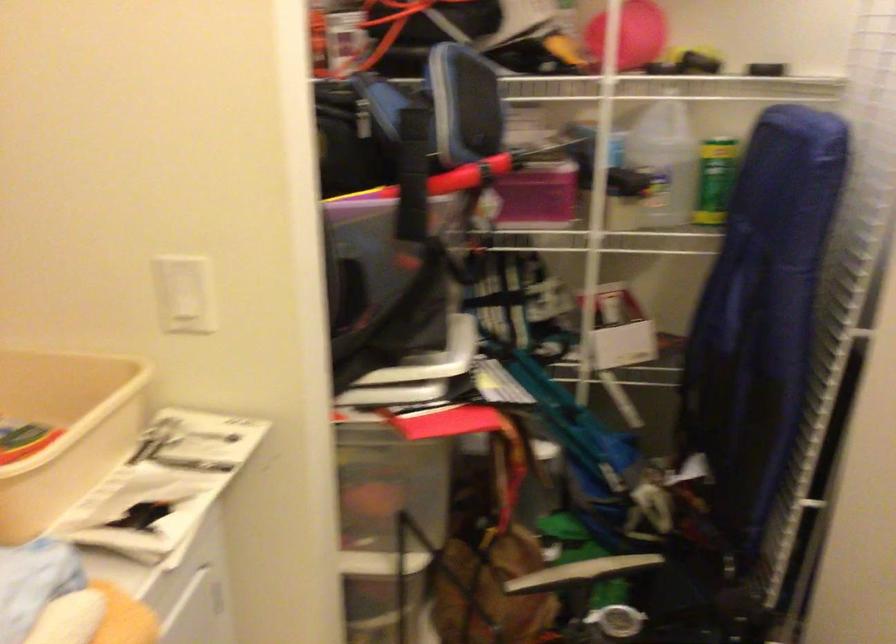
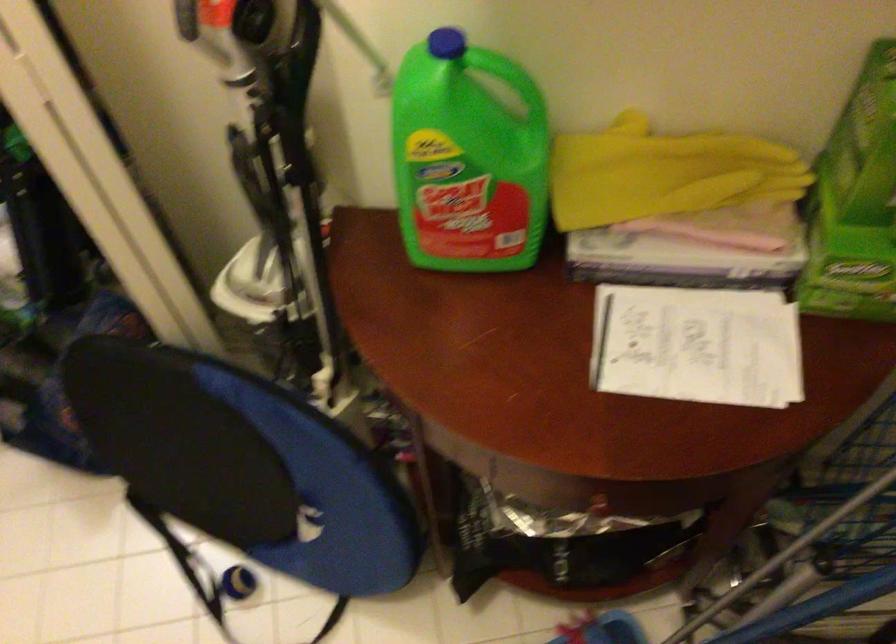
Question: How did the camera likely rotate?

Choices:
 (A) Left
 (B) Right
 (C) Up
 (D) Down

Answer: (D)